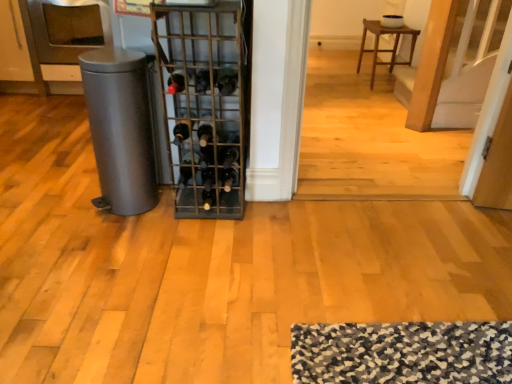
Question: Is the surface of matte gray trash can at left in direct contact with black glass wine bottle at center, which is counted as the 2th wine bottle, starting from the right?

Choices:
 (A) no
 (B) yes

Answer: (A)

Question: From a real-world perspective, is matte gray trash can at left physically above black glass wine bottle at center, marked as the 5th wine bottle in a left-to-right arrangement?

Choices:
 (A) no
 (B) yes

Answer: (A)

Question: Can you confirm if matte gray trash can at left is shorter than black glass wine bottle at center, which is counted as the 2th wine bottle, starting from the right?

Choices:
 (A) yes
 (B) no

Answer: (B)

Question: Is matte gray trash can at left far from black glass wine bottle at center, which is counted as the 2th wine bottle, starting from the right?

Choices:
 (A) yes
 (B) no

Answer: (B)

Question: Is matte gray trash can at left smaller than black glass wine bottle at center, which is counted as the 2th wine bottle, starting from the right?

Choices:
 (A) yes
 (B) no

Answer: (B)

Question: In terms of height, does black glass wine bottle at center, the first wine bottle from the left, look taller or shorter compared to black glass wine bottle at center, acting as the fourth wine bottle starting from the left?

Choices:
 (A) tall
 (B) short

Answer: (B)

Question: Considering the positions of black glass wine bottle at center, the first wine bottle from the left, and black glass wine bottle at center, acting as the fourth wine bottle starting from the left, in the image, is black glass wine bottle at center, the first wine bottle from the left, bigger or smaller than black glass wine bottle at center, acting as the fourth wine bottle starting from the left,?

Choices:
 (A) small
 (B) big

Answer: (A)

Question: In the image, is black glass wine bottle at center, the 6th wine bottle from the right, on the left side or the right side of black glass wine bottle at center, which is the 3th wine bottle from right to left?

Choices:
 (A) left
 (B) right

Answer: (A)

Question: From the image's perspective, is black glass wine bottle at center, the first wine bottle from the left, positioned above or below black glass wine bottle at center, acting as the fourth wine bottle starting from the left?

Choices:
 (A) above
 (B) below

Answer: (B)

Question: Considering the positions of black glass wine bottle at center, which appears as the third wine bottle when viewed from the left, and matte gray trash can at left in the image, is black glass wine bottle at center, which appears as the third wine bottle when viewed from the left, taller or shorter than matte gray trash can at left?

Choices:
 (A) tall
 (B) short

Answer: (B)

Question: Is black glass wine bottle at center, marked as the 4th wine bottle in a right-to-left arrangement, in front of or behind matte gray trash can at left in the image?

Choices:
 (A) behind
 (B) front

Answer: (A)

Question: Looking at their shapes, would you say black glass wine bottle at center, which appears as the third wine bottle when viewed from the left, is wider or thinner than matte gray trash can at left?

Choices:
 (A) thin
 (B) wide

Answer: (B)

Question: Does point (207, 198) appear closer or farther from the camera than point (119, 155)?

Choices:
 (A) farther
 (B) closer

Answer: (A)

Question: Is black glass wine bottle at center, marked as the 5th wine bottle in a left-to-right arrangement, to the left or to the right of brown wooden stool at upper center in the image?

Choices:
 (A) right
 (B) left

Answer: (B)

Question: In terms of height, does black glass wine bottle at center, which is counted as the 2th wine bottle, starting from the right, look taller or shorter compared to brown wooden stool at upper center?

Choices:
 (A) short
 (B) tall

Answer: (A)